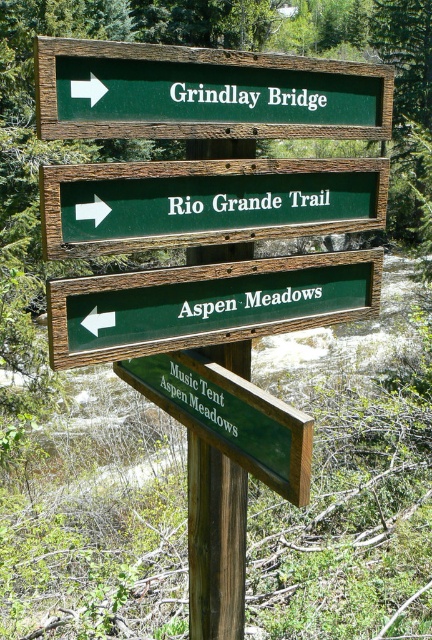
Question: Does green wooden sign at upper center appear under brown wooden signpost at center?

Choices:
 (A) yes
 (B) no

Answer: (B)

Question: Is green wooden sign at center to the left of brown wooden signpost at center from the viewer's perspective?

Choices:
 (A) no
 (B) yes

Answer: (A)

Question: Which object appears closest to the camera in this image?

Choices:
 (A) green wooden sign at lower left
 (B) green wooden sign at lower right

Answer: (B)

Question: Considering the real-world distances, which object is farthest from the green wooden sign at center?

Choices:
 (A) green wooden sign at lower right
 (B) green wooden sign at lower left

Answer: (A)

Question: Does green wooden sign at upper center have a lesser width compared to green wooden sign at center?

Choices:
 (A) yes
 (B) no

Answer: (A)

Question: Which point is closer to the camera taking this photo?

Choices:
 (A) (130, 355)
 (B) (91, 221)
 (C) (197, 369)

Answer: (B)